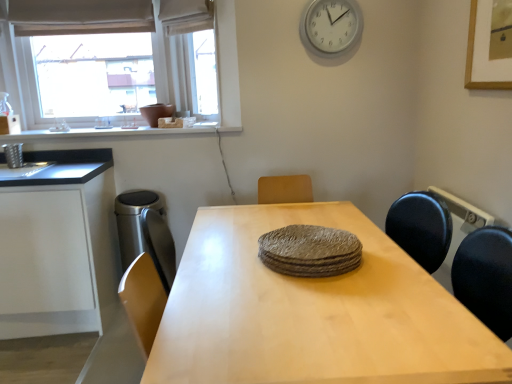
Question: Should I look upward or downward to see textured gray plates at center?

Choices:
 (A) up
 (B) down

Answer: (B)

Question: From a real-world perspective, is satin silver trash can at left positioned under light wood table at center based on gravity?

Choices:
 (A) no
 (B) yes

Answer: (A)

Question: Does satin silver trash can at left have a smaller size compared to light wood table at center?

Choices:
 (A) no
 (B) yes

Answer: (B)

Question: Is satin silver trash can at left facing towards light wood table at center?

Choices:
 (A) yes
 (B) no

Answer: (B)

Question: From the image's perspective, is satin silver trash can at left located beneath light wood table at center?

Choices:
 (A) yes
 (B) no

Answer: (B)

Question: Is light wood table at center inside satin silver trash can at left?

Choices:
 (A) yes
 (B) no

Answer: (B)

Question: Considering the relative sizes of satin silver trash can at left and light wood table at center in the image provided, is satin silver trash can at left taller than light wood table at center?

Choices:
 (A) no
 (B) yes

Answer: (A)

Question: Considering the relative sizes of white matte cabinet at left and white plastic clock at upper center in the image provided, is white matte cabinet at left taller than white plastic clock at upper center?

Choices:
 (A) yes
 (B) no

Answer: (A)

Question: Is the position of white matte cabinet at left more distant than that of white plastic clock at upper center?

Choices:
 (A) no
 (B) yes

Answer: (A)

Question: Is white matte cabinet at left looking in the opposite direction of white plastic clock at upper center?

Choices:
 (A) no
 (B) yes

Answer: (A)

Question: Is white matte cabinet at left bigger than white plastic clock at upper center?

Choices:
 (A) no
 (B) yes

Answer: (B)

Question: Is there a large distance between white matte cabinet at left and white plastic clock at upper center?

Choices:
 (A) yes
 (B) no

Answer: (A)

Question: Does white matte cabinet at left have a greater width compared to white plastic clock at upper center?

Choices:
 (A) no
 (B) yes

Answer: (B)

Question: Does white plastic clock at upper center have a lesser height compared to white matte window sill at upper left?

Choices:
 (A) no
 (B) yes

Answer: (A)